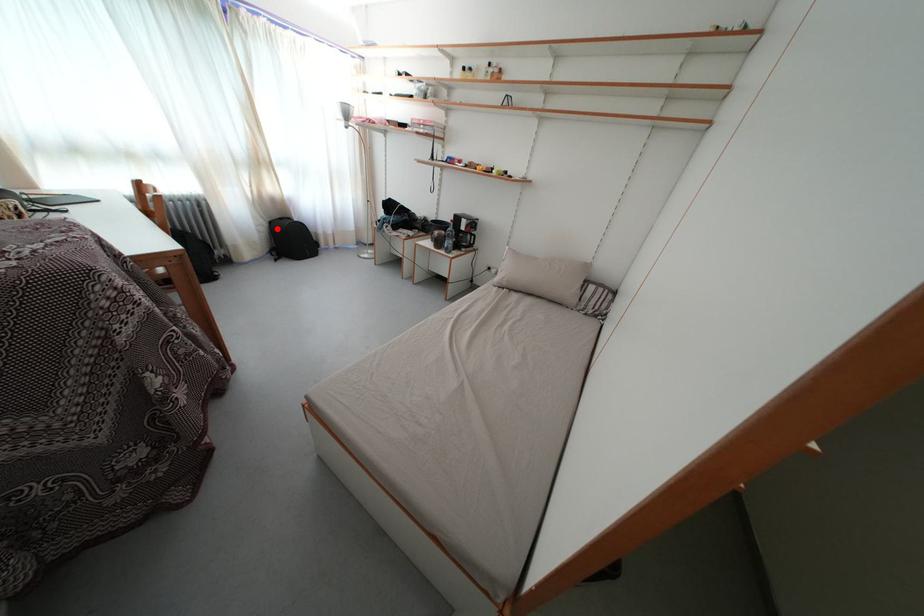
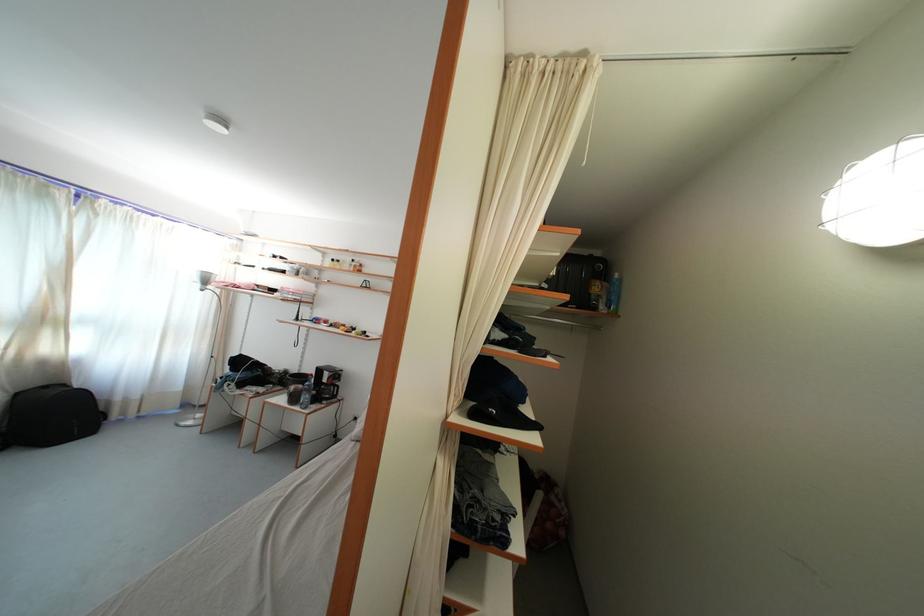
In the second image, find the point that corresponds to the highlighted location in the first image.

(23, 400)